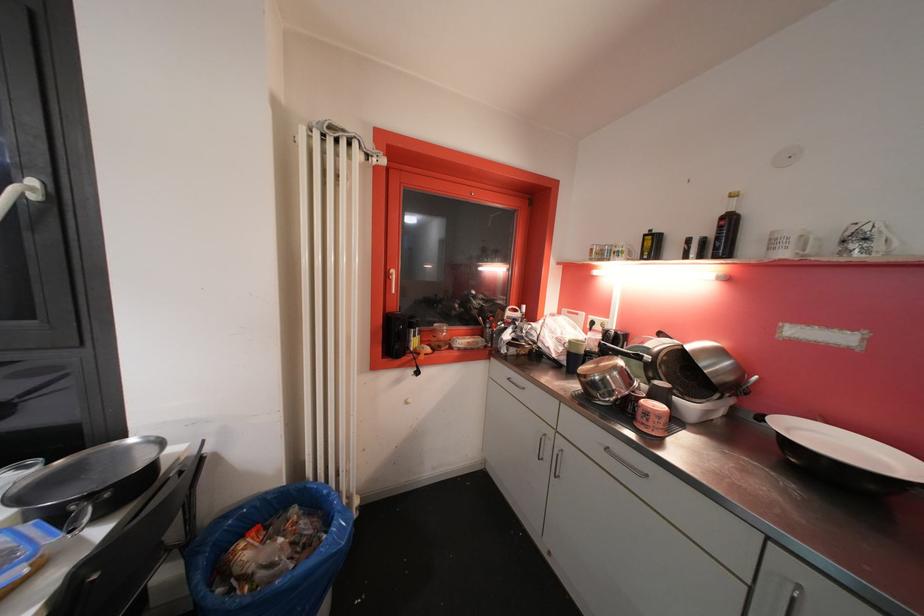
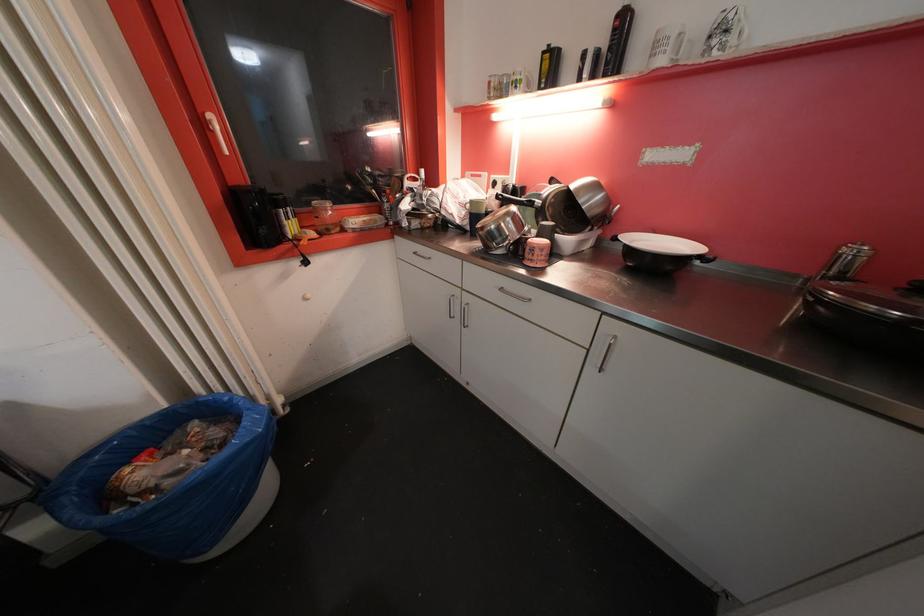
Where in the second image is the point corresponding to pixel 612 451 from the first image?

(506, 292)